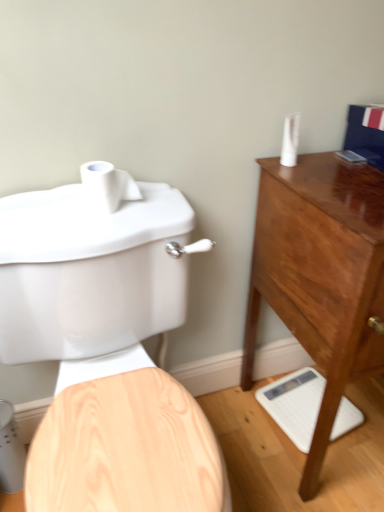
Locate an element on the screen. This screenshot has height=512, width=384. free area in between matte white toilet at left and mahogany wood chest of drawers at right is located at coordinates click(x=250, y=449).